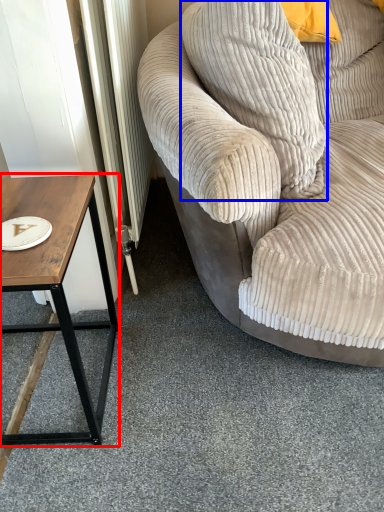
Question: Which object is further to the camera taking this photo, coffee table (highlighted by a red box) or pillow (highlighted by a blue box)?

Choices:
 (A) coffee table
 (B) pillow

Answer: (B)